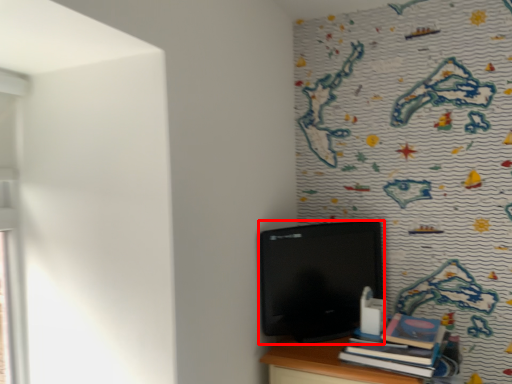
Question: From the image's perspective, considering the relative positions of computer (annotated by the red box) and book in the image provided, where is computer (annotated by the red box) located with respect to the staircase?

Choices:
 (A) above
 (B) below

Answer: (A)